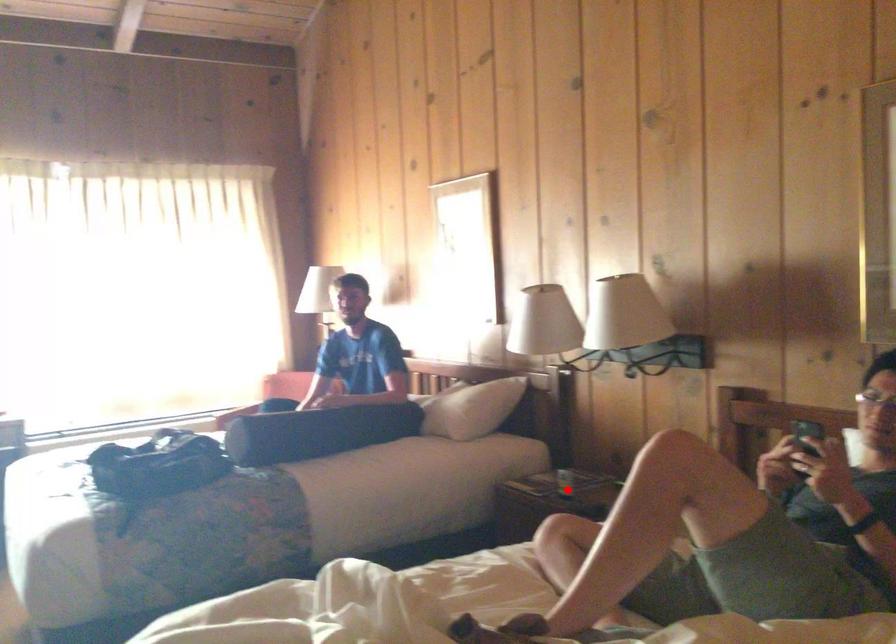
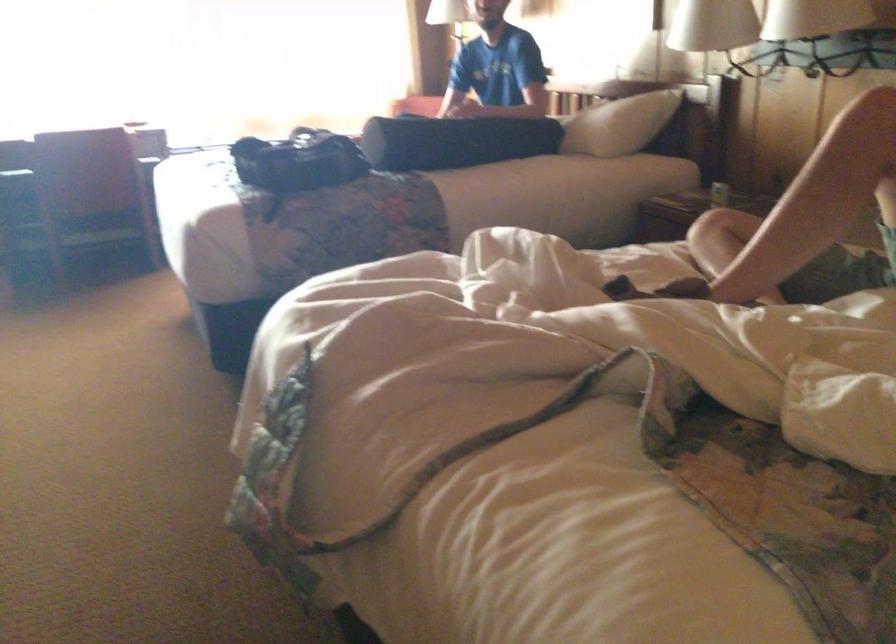
Find the pixel in the second image that matches the highlighted location in the first image.

(719, 194)